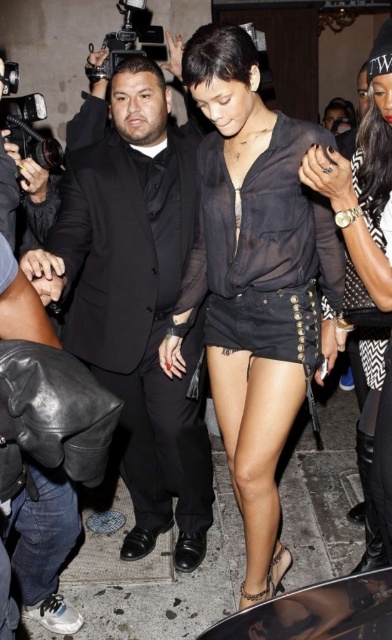
Between sheer black blouse at center and matte black suit at center, which one has more height?

Standing taller between the two is matte black suit at center.

Is sheer black blouse at center positioned behind matte black suit at center?

Yes, it is.

Between point (223, 433) and point (134, 353), which one is positioned behind?

The point (134, 353) is more distant.

Where is `sheer black blouse at center`? The height and width of the screenshot is (640, 392). sheer black blouse at center is located at coordinates (255, 280).

Can you confirm if sheer black dress at center is positioned above black sheer blouse at center?

Yes, sheer black dress at center is above black sheer blouse at center.

Is point (194, 275) in front of point (362, 356)?

Yes, it is.

Does point (288, 179) lie behind point (375, 81)?

Yes, it is.

In order to click on sheer black dress at center in this screenshot , I will do `click(261, 225)`.

Looking at this image, is sheer black blouse at center to the left of sheer black dress at center from the viewer's perspective?

Correct, you'll find sheer black blouse at center to the left of sheer black dress at center.

How distant is sheer black blouse at center from sheer black dress at center?

sheer black blouse at center and sheer black dress at center are 2.92 inches apart from each other.

Between point (263, 260) and point (312, 125), which one is positioned behind?

Positioned behind is point (263, 260).

What are the coordinates of `sheer black blouse at center` in the screenshot? It's located at (255, 280).